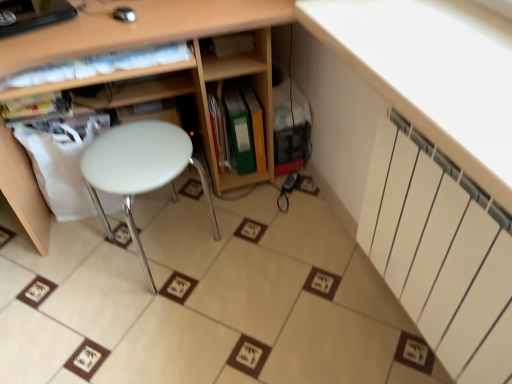
Find the location of a particular element. free point below white matte radiator at upper right (from a real-world perspective) is located at coordinates click(399, 334).